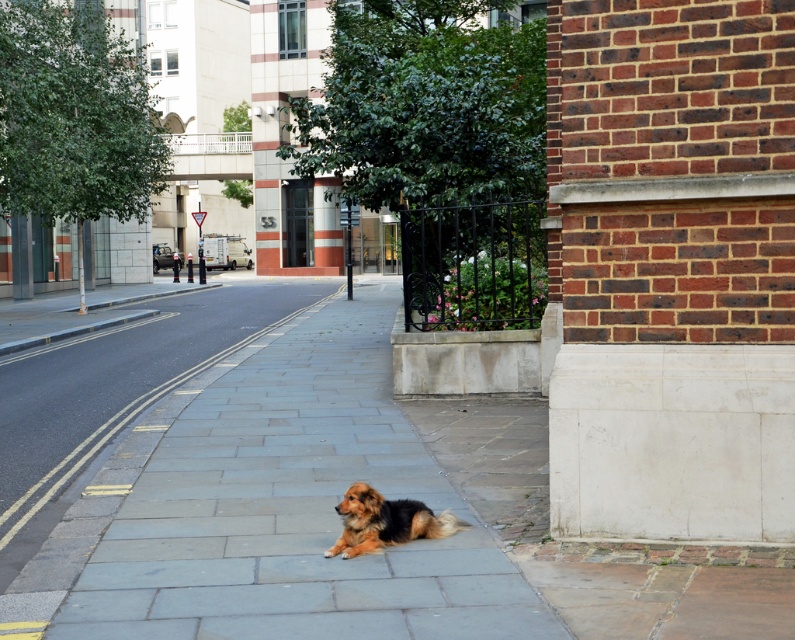
Is gray stone pavement at center bigger than brown fluffy dog at center?

Yes, gray stone pavement at center is bigger than brown fluffy dog at center.

Does gray stone pavement at center appear over brown fluffy dog at center?

Correct, gray stone pavement at center is located above brown fluffy dog at center.

What do you see at coordinates (270, 509) in the screenshot?
I see `gray stone pavement at center` at bounding box center [270, 509].

What are the coordinates of `gray stone pavement at center` in the screenshot? It's located at (270, 509).